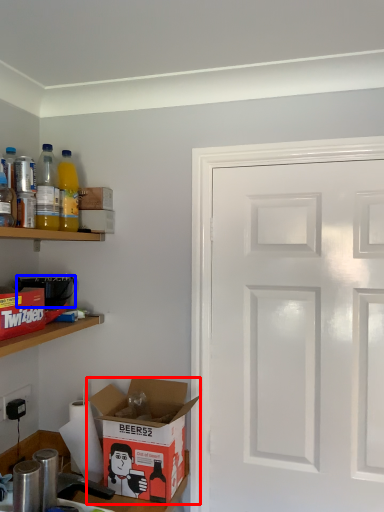
Question: Which of the following is the farthest to the observer, box (highlighted by a red box) or appliance (highlighted by a blue box)?

Choices:
 (A) box
 (B) appliance

Answer: (B)